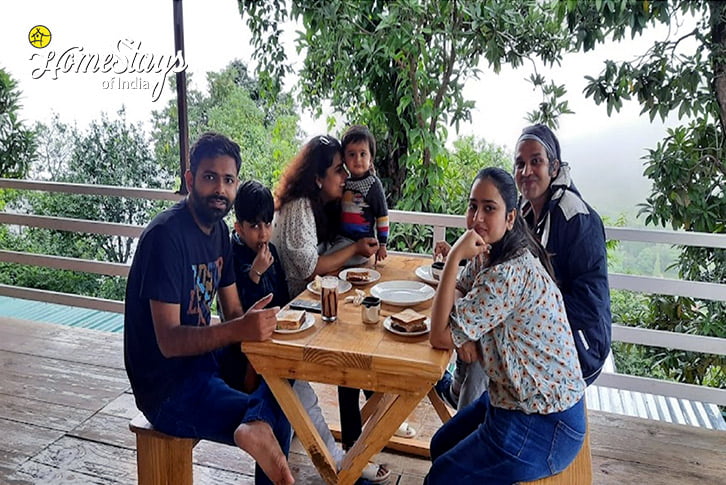
Locate an element on the screen. wooden floor is located at coordinates (67, 442).